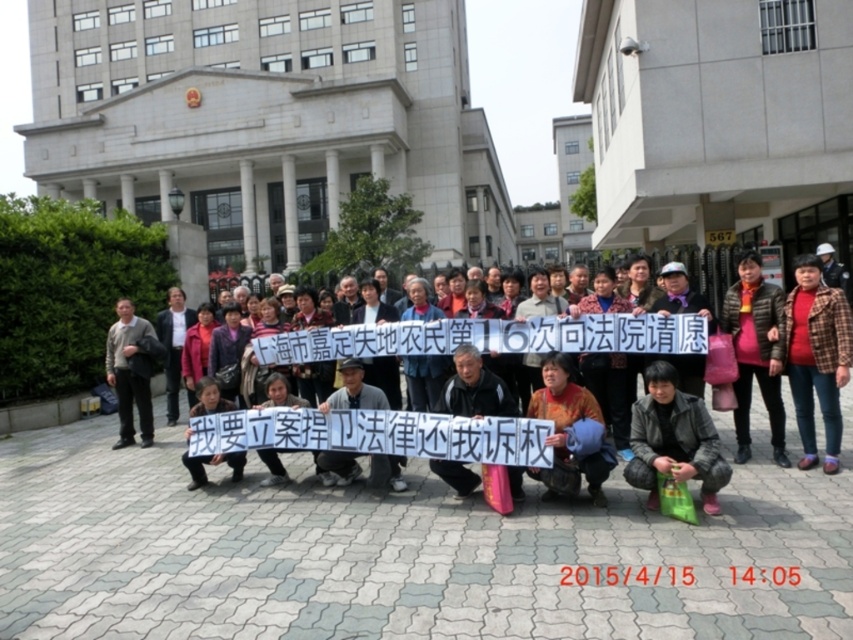
You are a photographer at the scene and want to capture both the red plaid shirt at center and the gray sweater at left in a single shot. Which person should be closer to the camera to ensure both are fully visible?

The red plaid shirt at center is positioned over the gray sweater at left, so the person wearing the red plaid shirt at center should be closer to the camera to ensure both are fully visible.

You are a photographer standing in front of the large building. You want to capture both the matte black sign at center and the red plaid shirt at center in a single photo. Which object should you focus on first to ensure both are in frame?

The matte black sign at center has a larger size compared to the red plaid shirt at center. To ensure both are in frame, focus on the larger matte black sign at center first, as it requires more space in the composition.